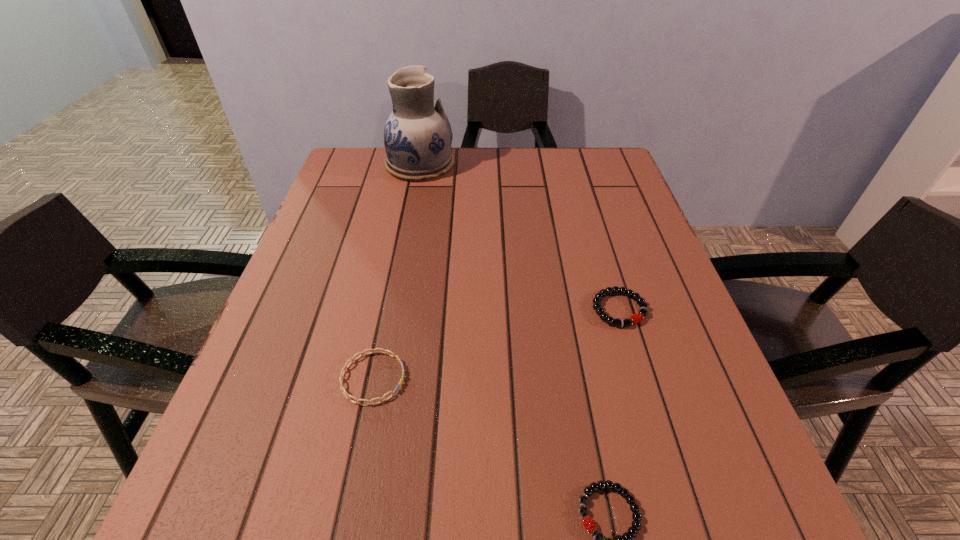
Locate an element on the screen. This screenshot has height=540, width=960. pottery is located at coordinates (417, 136).

Locate an element on the screen. Image resolution: width=960 pixels, height=540 pixels. the farthest object is located at coordinates (417, 136).

The height and width of the screenshot is (540, 960). I want to click on the second farthest object, so click(636, 318).

Locate an element on the screen. The image size is (960, 540). the farthest bracelet is located at coordinates (636, 318).

Locate an element on the screen. The width and height of the screenshot is (960, 540). the third farthest object is located at coordinates (352, 359).

At what (x,y) coordinates should I click in order to perform the action: click on the second nearest bracelet. Please return your answer as a coordinate pair (x, y). Looking at the image, I should click on (352, 359).

Locate an element on the screen. The height and width of the screenshot is (540, 960). free space located on the front of the farthest object is located at coordinates (414, 195).

Where is `free location located 0.200m on the back of the rightmost object`? free location located 0.200m on the back of the rightmost object is located at coordinates (596, 232).

This screenshot has width=960, height=540. I want to click on free space located 0.170m on the surface of the second nearest object showing star-shaped elements, so click(x=500, y=378).

Locate an element on the screen. Image resolution: width=960 pixels, height=540 pixels. object located in the far edge section of the desktop is located at coordinates (417, 136).